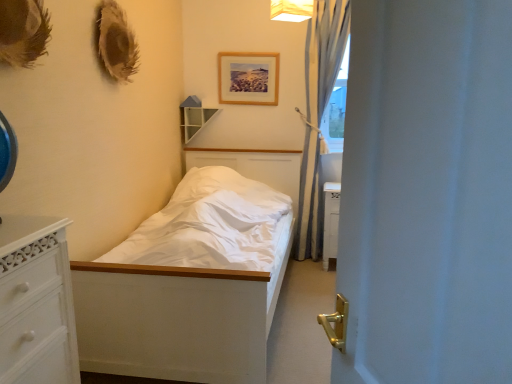
Question: Does wooden picture frame at upper center have a lesser width compared to white matte door at center?

Choices:
 (A) no
 (B) yes

Answer: (B)

Question: Is wooden picture frame at upper center not within white matte door at center?

Choices:
 (A) no
 (B) yes

Answer: (B)

Question: Can you confirm if wooden picture frame at upper center is smaller than white matte door at center?

Choices:
 (A) no
 (B) yes

Answer: (B)

Question: Is white matte door at center inside wooden picture frame at upper center?

Choices:
 (A) no
 (B) yes

Answer: (A)

Question: Does wooden picture frame at upper center have a greater width compared to white matte door at center?

Choices:
 (A) yes
 (B) no

Answer: (B)

Question: Does wooden picture frame at upper center appear on the right side of white matte door at center?

Choices:
 (A) yes
 (B) no

Answer: (B)

Question: Can you confirm if wooden shelf at upper center is bigger than white fabric lampshade at upper center?

Choices:
 (A) no
 (B) yes

Answer: (B)

Question: Is wooden shelf at upper center positioned behind white fabric lampshade at upper center?

Choices:
 (A) yes
 (B) no

Answer: (A)

Question: From the image's perspective, is wooden shelf at upper center below white fabric lampshade at upper center?

Choices:
 (A) yes
 (B) no

Answer: (A)

Question: Is wooden shelf at upper center thinner than white fabric lampshade at upper center?

Choices:
 (A) yes
 (B) no

Answer: (A)

Question: Can you confirm if wooden shelf at upper center is positioned to the right of white fabric lampshade at upper center?

Choices:
 (A) no
 (B) yes

Answer: (A)

Question: Does wooden shelf at upper center appear on the left side of white fabric lampshade at upper center?

Choices:
 (A) no
 (B) yes

Answer: (B)

Question: Could you tell me if light blue sheer curtain at right is facing white fabric lampshade at upper center?

Choices:
 (A) yes
 (B) no

Answer: (A)